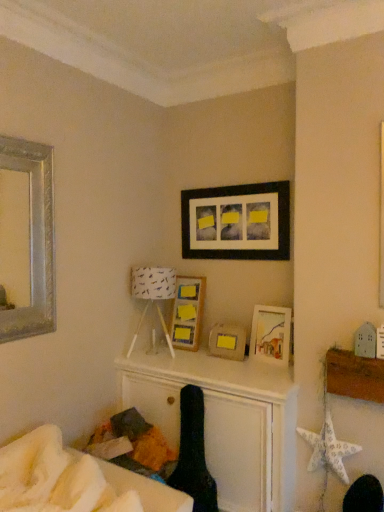
Question: Considering the positions of white soft bed at lower left and black fabric swivel chair at center in the image, is white soft bed at lower left bigger or smaller than black fabric swivel chair at center?

Choices:
 (A) big
 (B) small

Answer: (A)

Question: Looking at their shapes, would you say white soft bed at lower left is wider or thinner than black fabric swivel chair at center?

Choices:
 (A) wide
 (B) thin

Answer: (A)

Question: Estimate the real-world distances between objects in this image. Which object is farther from the matte wooden picture frame at center, which ranks as the third picture frame in left-to-right order?

Choices:
 (A) black fabric swivel chair at center
 (B) matte wooden picture frame at center-right, which is the 1th picture frame from right to left
 (C) white fabric lampshade at center
 (D) white soft bed at lower left
 (E) matte black picture frame at upper center, arranged as the 4th picture frame when viewed from the left

Answer: (D)

Question: Estimate the real-world distances between objects in this image. Which object is closer to the white fabric lampshade at center?

Choices:
 (A) matte black picture frame at upper center, arranged as the 4th picture frame when viewed from the left
 (B) matte wooden picture frame at center, which is the third picture frame in right-to-left order
 (C) matte wooden picture frame at center-right, which is the 1th picture frame from right to left
 (D) white paper star at lower right
 (E) wooden frame with sticky notes at upper center, which is counted as the 2th picture frame, starting from the left

Answer: (E)